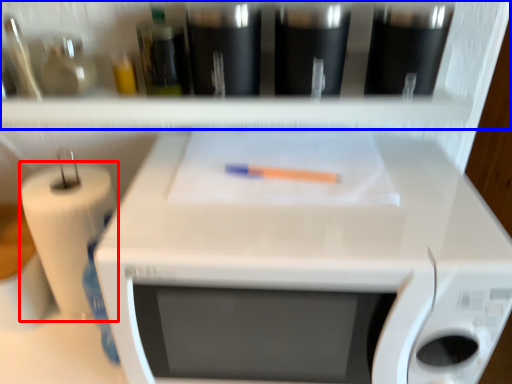
Question: Which point is closer to the camera, paper towel (highlighted by a red box) or shelf (highlighted by a blue box)?

Choices:
 (A) paper towel
 (B) shelf

Answer: (B)